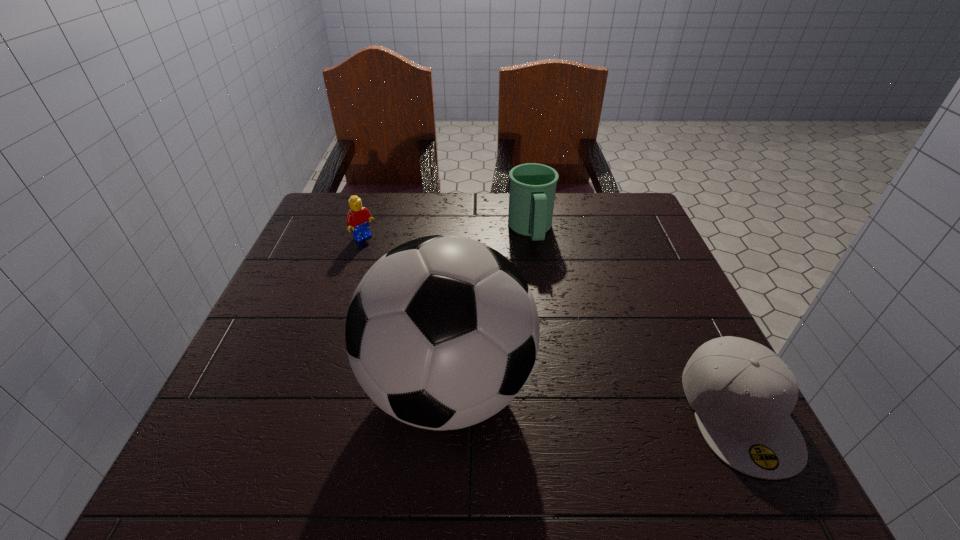
Locate an element on the screen. Image resolution: width=960 pixels, height=540 pixels. object that is at the near right corner is located at coordinates (742, 393).

Where is `vacant space at the far edge of the desktop`? This screenshot has height=540, width=960. vacant space at the far edge of the desktop is located at coordinates (569, 238).

Where is `free region at the left edge`? free region at the left edge is located at coordinates click(271, 380).

The image size is (960, 540). Identify the location of vacant space at the right edge. (656, 320).

Locate an element on the screen. This screenshot has width=960, height=540. free region at the far left corner of the desktop is located at coordinates click(x=365, y=206).

The height and width of the screenshot is (540, 960). What are the coordinates of `free space at the near left corner of the desktop` in the screenshot? It's located at (303, 417).

The image size is (960, 540). I want to click on vacant area at the far right corner of the desktop, so click(607, 220).

Where is `free space that is in between the shortest object and the leftmost object`? Image resolution: width=960 pixels, height=540 pixels. free space that is in between the shortest object and the leftmost object is located at coordinates (551, 325).

Where is `vacant point located between the shortest object and the third tallest object`? The image size is (960, 540). vacant point located between the shortest object and the third tallest object is located at coordinates (551, 325).

Find the location of a particular element. The height and width of the screenshot is (540, 960). empty space between the third tallest object and the mug is located at coordinates (447, 235).